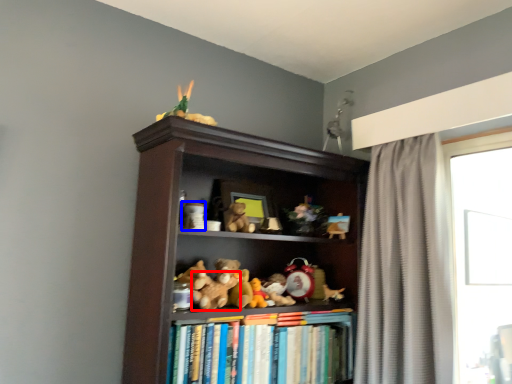
Question: Which object appears closest to the camera in this image, toy (highlighted by a red box) or toy (highlighted by a blue box)?

Choices:
 (A) toy
 (B) toy

Answer: (A)